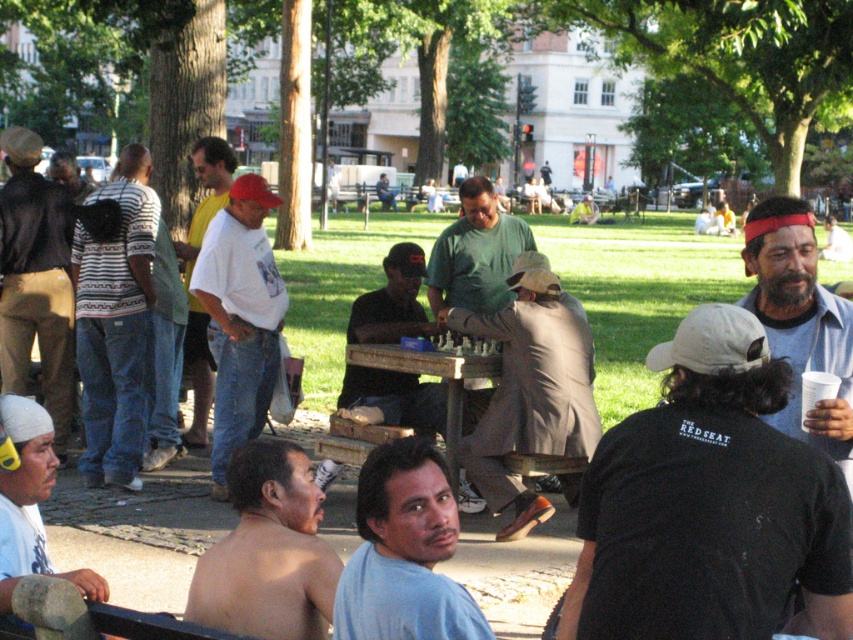
Is blue t-shirt at lower center shorter than matte brown cap at center?

Yes, blue t-shirt at lower center is shorter than matte brown cap at center.

The height and width of the screenshot is (640, 853). Describe the element at coordinates (404, 552) in the screenshot. I see `blue t-shirt at lower center` at that location.

Identify the location of blue t-shirt at lower center. This screenshot has width=853, height=640. (404, 552).

Is light blue shirt at lower left closer to the viewer compared to wooden picnic table at center?

Yes, light blue shirt at lower left is closer to the viewer.

Between point (24, 516) and point (453, 362), which one is positioned behind?

The point (453, 362) is behind.

Identify the location of light blue shirt at lower left. (30, 502).

Does black cotton cap at center have a larger size compared to light blue shirt at lower left?

Yes, black cotton cap at center is bigger than light blue shirt at lower left.

Can you confirm if black cotton cap at center is smaller than light blue shirt at lower left?

Incorrect, black cotton cap at center is not smaller in size than light blue shirt at lower left.

Who is more distant from viewer, (x=750, y=317) or (x=10, y=541)?

Point (x=10, y=541)

I want to click on black cotton cap at center, so click(709, 502).